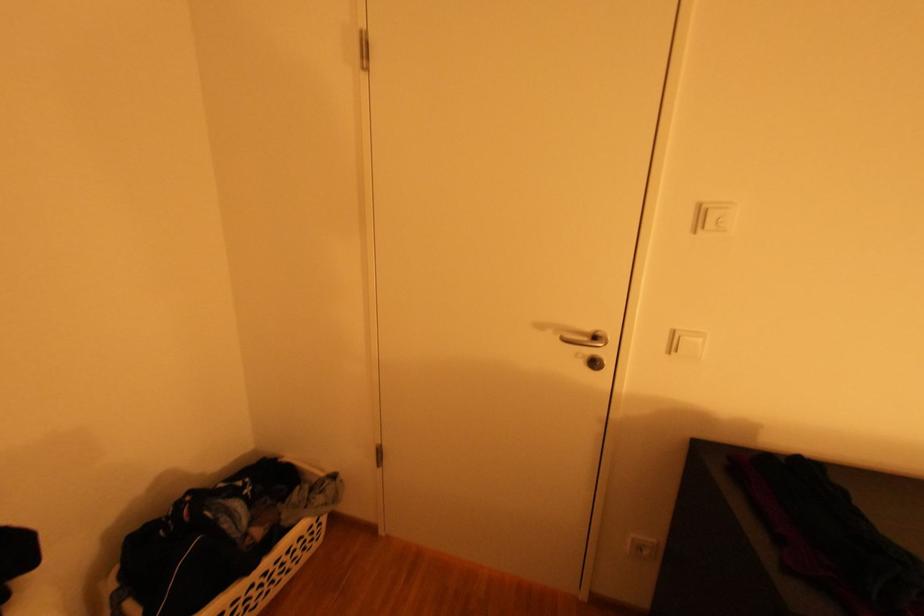
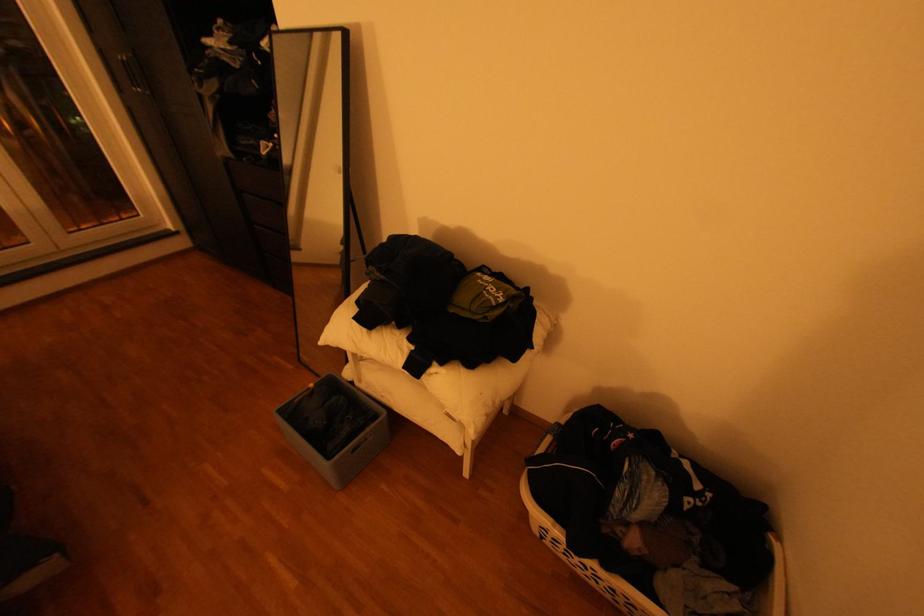
How did the camera likely rotate?

The camera rotated toward left-down.